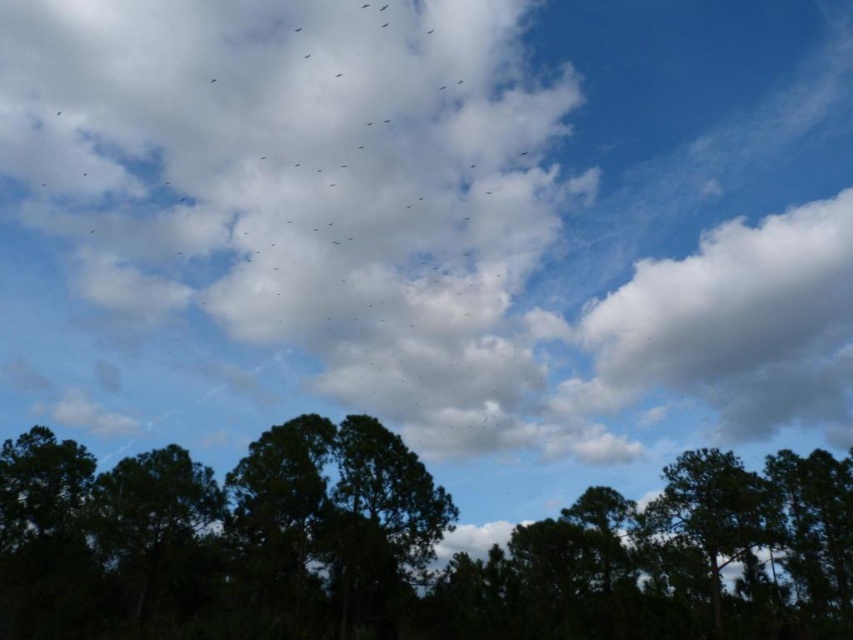
Looking at this image, is white fluffy cloud at upper center in front of dark green foliage at center?

No.

Locate an element on the screen. white fluffy cloud at upper center is located at coordinates (439, 212).

Which is in front, point (314, 317) or point (299, 572)?

Point (299, 572) is in front.

This screenshot has width=853, height=640. I want to click on white fluffy cloud at upper center, so click(439, 212).